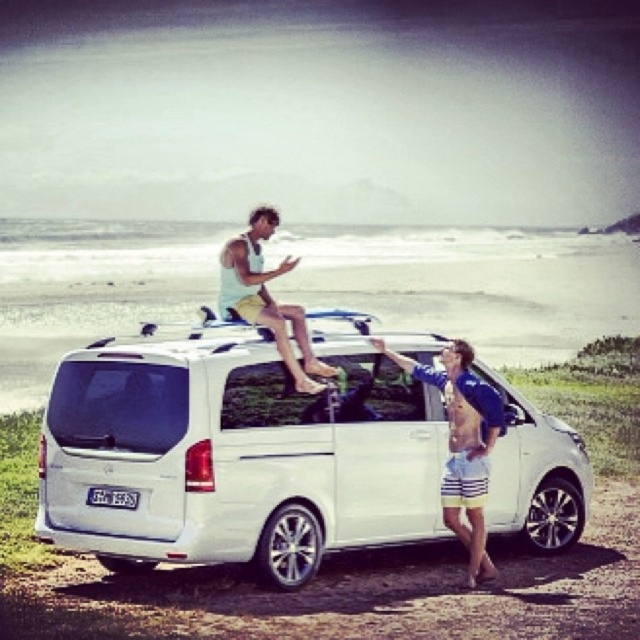
Question: Which object is positioned closest to the matte white surfboard at upper center?

Choices:
 (A) white matte van at center
 (B) white matte surfboard at upper center

Answer: (A)

Question: Is white matte surfboard at upper center thinner than matte white surfboard at upper center?

Choices:
 (A) no
 (B) yes

Answer: (A)

Question: Which point is closer to the camera taking this photo?

Choices:
 (A) (467, 369)
 (B) (288, 358)

Answer: (B)

Question: Which object is the farthest from the white matte van at center?

Choices:
 (A) white matte surfboard at upper center
 (B) matte white surfboard at upper center

Answer: (A)

Question: In this image, where is white matte van at center located relative to matte white surfboard at upper center?

Choices:
 (A) above
 (B) below

Answer: (B)

Question: Does white matte van at center appear on the left side of white matte surfboard at upper center?

Choices:
 (A) no
 (B) yes

Answer: (B)